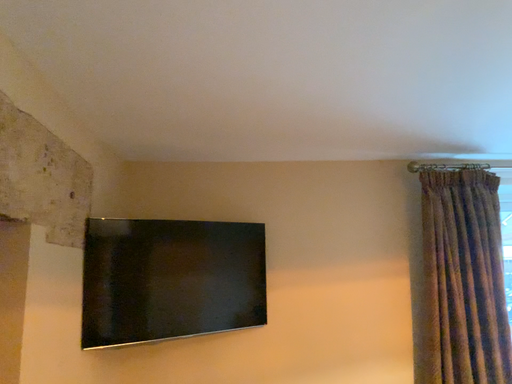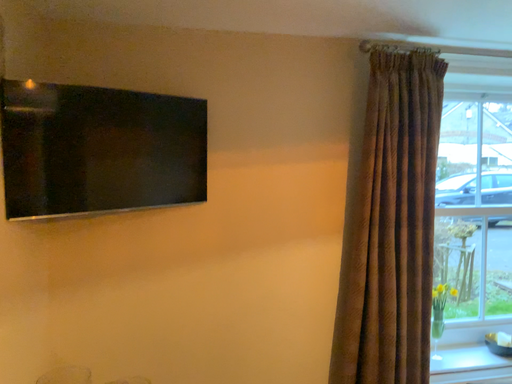
Question: How did the camera likely rotate when shooting the video?

Choices:
 (A) rotated left
 (B) rotated right

Answer: (B)